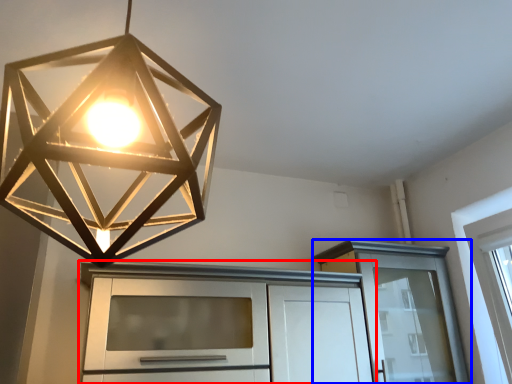
Question: Which point is closer to the camera, cabinetry (highlighted by a red box) or cabinetry (highlighted by a blue box)?

Choices:
 (A) cabinetry
 (B) cabinetry

Answer: (A)